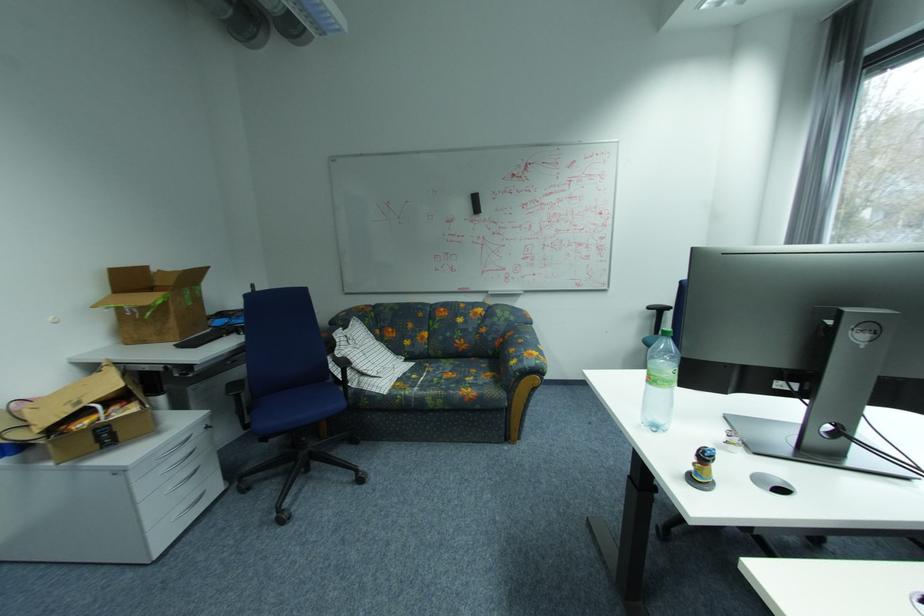
Image resolution: width=924 pixels, height=616 pixels. What do you see at coordinates (237, 390) in the screenshot?
I see `a black chair armrest` at bounding box center [237, 390].